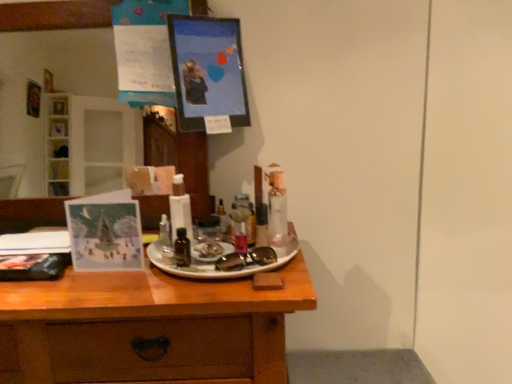
Question: From a real-world perspective, is metallic silver spray can at center, positioned as the 2th toiletry in back-to-front order, physically below metallic picture frame at upper center?

Choices:
 (A) yes
 (B) no

Answer: (A)

Question: Does metallic silver spray can at center, which is the third toiletry from left to right, have a lesser height compared to metallic picture frame at upper center?

Choices:
 (A) yes
 (B) no

Answer: (A)

Question: Could you tell me if metallic silver spray can at center, which is the third toiletry from left to right, is facing metallic picture frame at upper center?

Choices:
 (A) yes
 (B) no

Answer: (B)

Question: Does metallic silver spray can at center, which is the 1th toiletry from right to left, have a lesser width compared to metallic picture frame at upper center?

Choices:
 (A) no
 (B) yes

Answer: (B)

Question: From the image's perspective, is metallic silver spray can at center, positioned as the 2th toiletry in back-to-front order, located above metallic picture frame at upper center?

Choices:
 (A) yes
 (B) no

Answer: (B)

Question: Is metallic silver spray can at center, positioned as the 2th toiletry in back-to-front order, closer to camera compared to metallic picture frame at upper center?

Choices:
 (A) yes
 (B) no

Answer: (A)

Question: Is black glass bottle at center, the 3th toiletry from the right, in front of wooden desk at center?

Choices:
 (A) yes
 (B) no

Answer: (B)

Question: Is black glass bottle at center, positioned as the third toiletry in back-to-front order, aimed at wooden desk at center?

Choices:
 (A) no
 (B) yes

Answer: (A)

Question: Does black glass bottle at center, the 3th toiletry from the right, have a greater height compared to wooden desk at center?

Choices:
 (A) yes
 (B) no

Answer: (B)

Question: Is black glass bottle at center, positioned as the third toiletry in back-to-front order, thinner than wooden desk at center?

Choices:
 (A) yes
 (B) no

Answer: (A)

Question: Is black glass bottle at center, positioned as the third toiletry in back-to-front order, wider than wooden desk at center?

Choices:
 (A) no
 (B) yes

Answer: (A)

Question: Are black glass bottle at center, the 3th toiletry from the right, and wooden desk at center making contact?

Choices:
 (A) no
 (B) yes

Answer: (A)

Question: Is black glass bottle at center, the first toiletry positioned from the left, located outside translucent plastic tube at center, the first toiletry in the back-to-front sequence?

Choices:
 (A) yes
 (B) no

Answer: (A)